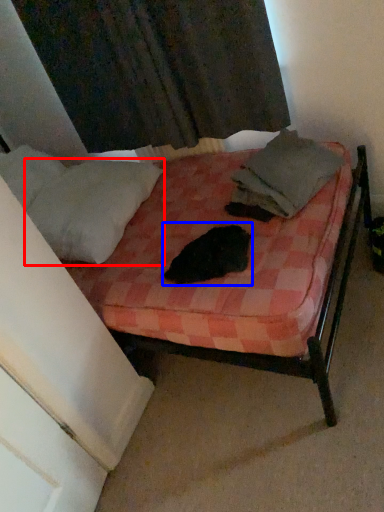
Question: Which object is further to the camera taking this photo, pillow (highlighted by a red box) or animal (highlighted by a blue box)?

Choices:
 (A) pillow
 (B) animal

Answer: (A)